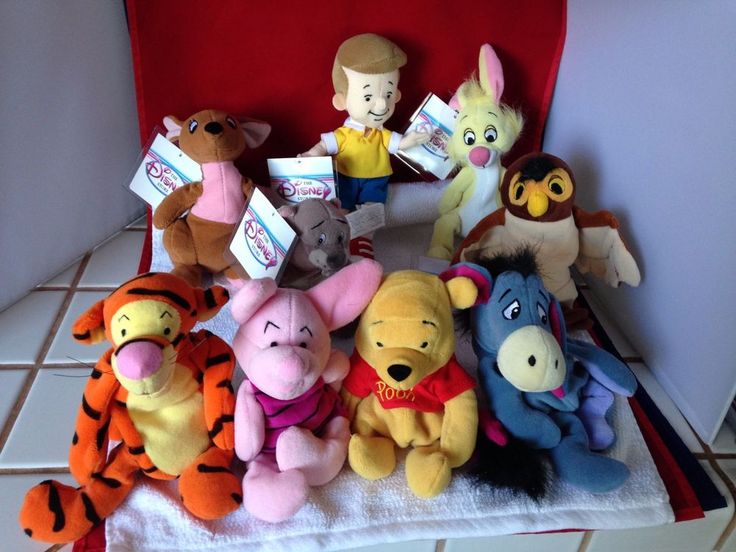
Find the location of a particular element. The width and height of the screenshot is (736, 552). stuffed toy is located at coordinates (145, 383), (294, 375), (406, 368), (531, 383), (553, 235), (480, 158), (375, 103), (311, 231), (218, 187).